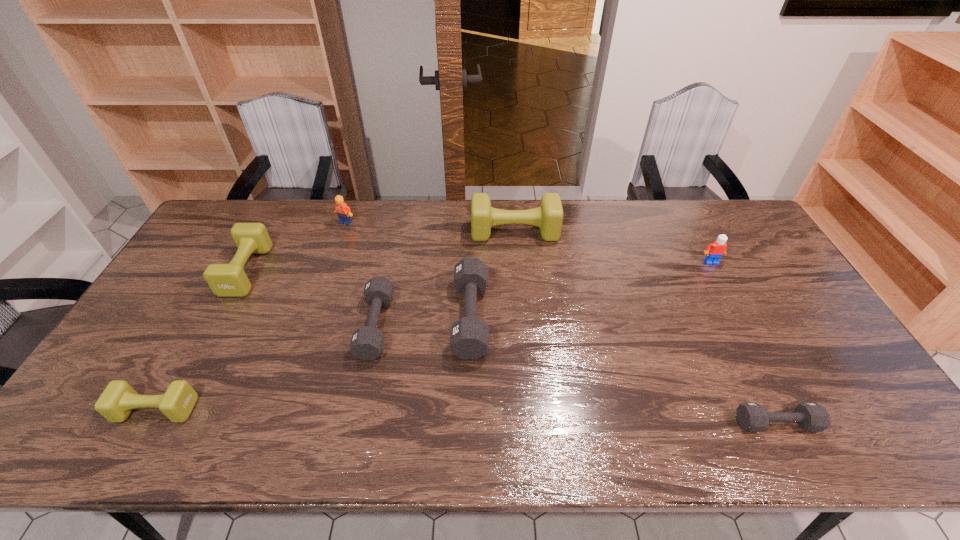
Where is `the biggest olive dumbbell`? Image resolution: width=960 pixels, height=540 pixels. the biggest olive dumbbell is located at coordinates pos(548,217).

Identify the location of the farthest dumbbell. (548, 217).

The image size is (960, 540). What are the coordinates of `orange Lego` in the screenshot? It's located at (343, 211).

At what (x,y) coordinates should I click in order to perform the action: click on the third object from left to right. Please return your answer as a coordinate pair (x, y). The height and width of the screenshot is (540, 960). Looking at the image, I should click on (343, 211).

Locate an element on the screen. The width and height of the screenshot is (960, 540). white Lego is located at coordinates (715, 251).

The height and width of the screenshot is (540, 960). I want to click on the right Lego, so click(715, 251).

In order to click on the second nearest olive dumbbell in this screenshot , I will do `click(225, 280)`.

Where is `the second gray dumbbell from left to right`? The height and width of the screenshot is (540, 960). the second gray dumbbell from left to right is located at coordinates (469, 337).

The image size is (960, 540). What are the coordinates of `the fourth dumbbell from right to left` in the screenshot? It's located at (367, 343).

You are a GUI agent. You are given a task and a screenshot of the screen. Output one action in this format:
    pyautogui.click(x=<x>, y=<y>)
    Task: Click on the second smallest gray dumbbell
    The width and height of the screenshot is (960, 540).
    Given the screenshot: What is the action you would take?
    pyautogui.click(x=367, y=343)